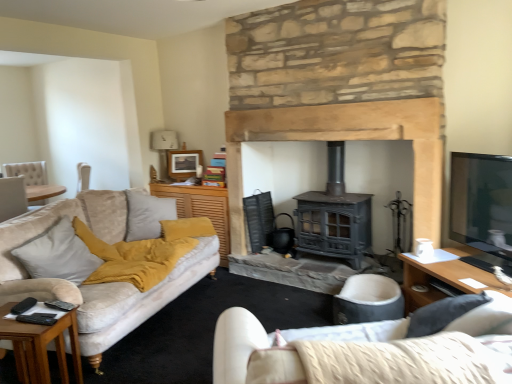
Describe the element at coordinates (201, 208) in the screenshot. The image size is (512, 384). I see `yellow fabric cushion at center, the 1th table when ordered from top to bottom` at that location.

At what (x,y) coordinates should I click in order to perform the action: click on wooden side table at lower left, placed as the first table when sorted from bottom to top. Please return your answer as a coordinate pair (x, y). The height and width of the screenshot is (384, 512). Looking at the image, I should click on (41, 347).

This screenshot has height=384, width=512. Find the location of `soft beige cushion at left`. soft beige cushion at left is located at coordinates (58, 254).

The image size is (512, 384). I want to click on wooden picture frame at upper center, so click(184, 163).

Describe the element at coordinates (369, 350) in the screenshot. I see `white fabric studio couch at lower right` at that location.

Image resolution: width=512 pixels, height=384 pixels. Describe the element at coordinates (340, 86) in the screenshot. I see `matte black stove at center` at that location.

This screenshot has height=384, width=512. I want to click on soft gray fabric armchair at center, so click(368, 300).

Is soft beige cushion at left touching white fabric studio couch at lower right?

soft beige cushion at left and white fabric studio couch at lower right are not in contact.

Is soft beige cushion at left to the left or to the right of white fabric studio couch at lower right in the image?

Based on their positions, soft beige cushion at left is located to the left of white fabric studio couch at lower right.

Where is `pillow below the white fabric studio couch at lower right (from a real-world perspective)`? This screenshot has width=512, height=384. pillow below the white fabric studio couch at lower right (from a real-world perspective) is located at coordinates (58, 254).

Is soft beige cushion at left oriented away from white fabric studio couch at lower right?

No, soft beige cushion at left's orientation is not away from white fabric studio couch at lower right.

From a real-world perspective, which object rests below the other?

soft gray fabric armchair at center, from a real-world perspective.

From the picture: Considering the relative sizes of soft gray fabric armchair at center and white fabric lampshade at upper center in the image provided, is soft gray fabric armchair at center shorter than white fabric lampshade at upper center?

Yes, soft gray fabric armchair at center is shorter than white fabric lampshade at upper center.

Is soft gray fabric armchair at center with white fabric lampshade at upper center?

No, soft gray fabric armchair at center is not making contact with white fabric lampshade at upper center.

From the image's perspective, would you say soft gray fabric armchair at center is shown under white fabric lampshade at upper center?

Correct, soft gray fabric armchair at center appears lower than white fabric lampshade at upper center in the image.

Could you tell me if wooden side table at lower left, the 2th table in the back-to-front sequence, is facing yellow fabric cushion at center, positioned as the second table in front-to-back order?

No, wooden side table at lower left, the 2th table in the back-to-front sequence, is not aimed at yellow fabric cushion at center, positioned as the second table in front-to-back order.

Which object is further away from the camera, wooden side table at lower left, the 1th table from the left, or yellow fabric cushion at center, the 1th table when ordered from top to bottom?

yellow fabric cushion at center, the 1th table when ordered from top to bottom, is further from the camera.

From the image's perspective, who appears lower, wooden side table at lower left, which is counted as the second table, starting from the top, or yellow fabric cushion at center, the first table when ordered from back to front?

wooden side table at lower left, which is counted as the second table, starting from the top, from the image's perspective.

Does wooden side table at lower left, the second table when ordered from right to left, have a smaller size compared to yellow fabric cushion at center, the 1th table when ordered from top to bottom?

No.

Is yellow fabric cushion at center, the 1th table when ordered from top to bottom, aimed at white fabric lampshade at upper center?

No, yellow fabric cushion at center, the 1th table when ordered from top to bottom, is not turned towards white fabric lampshade at upper center.

Between point (207, 206) and point (166, 133), which one is positioned behind?

The point (166, 133) is farther from the camera.

From the image's perspective, would you say yellow fabric cushion at center, the first table when ordered from back to front, is positioned over white fabric lampshade at upper center?

No, from the image's perspective, yellow fabric cushion at center, the first table when ordered from back to front, is not on top of white fabric lampshade at upper center.

In the scene shown: Could you measure the distance between wooden side table at lower left, the 1th table from the left, and white fabric studio couch at lower right?

The distance of wooden side table at lower left, the 1th table from the left, from white fabric studio couch at lower right is 1.55 meters.

Which of these two, wooden side table at lower left, the 2th table in the back-to-front sequence, or white fabric studio couch at lower right, is bigger?

With larger size is white fabric studio couch at lower right.

Which object is more forward, wooden side table at lower left, which ranks as the 1th table in front-to-back order, or white fabric studio couch at lower right?

white fabric studio couch at lower right is more forward.

Which object is wider, wooden side table at lower left, the 1th table from the left, or white fabric studio couch at lower right?

white fabric studio couch at lower right.

In the scene shown: Is the surface of white fabric studio couch at lower right in direct contact with matte black stove at center?

No, white fabric studio couch at lower right is not beside matte black stove at center.

Is white fabric studio couch at lower right spatially inside matte black stove at center, or outside of it?

white fabric studio couch at lower right is spatially situated outside matte black stove at center.

Which of these two, white fabric studio couch at lower right or matte black stove at center, is wider?

Wider between the two is white fabric studio couch at lower right.

Between white fabric studio couch at lower right and matte black stove at center, which one has more height?

matte black stove at center is taller.

Looking at this image, is white fabric studio couch at lower right positioned before yellow fabric cushion at center, acting as the 1th table starting from the right?

Yes, white fabric studio couch at lower right is in front of yellow fabric cushion at center, acting as the 1th table starting from the right.

You are a GUI agent. You are given a task and a screenshot of the screen. Output one action in this format:
    pyautogui.click(x=<x>, y=<y>)
    Task: Click on the studio couch that is below the yellow fabric cushion at center, the first table when ordered from back to front (from the image's perspective)
    The image size is (512, 384).
    Given the screenshot: What is the action you would take?
    click(x=369, y=350)

Is white fabric studio couch at lower right turned away from yellow fabric cushion at center, acting as the 1th table starting from the right?

white fabric studio couch at lower right is not turned away from yellow fabric cushion at center, acting as the 1th table starting from the right.

Considering the sizes of objects white fabric studio couch at lower right and yellow fabric cushion at center, acting as the 1th table starting from the right, in the image provided, who is bigger, white fabric studio couch at lower right or yellow fabric cushion at center, acting as the 1th table starting from the right,?

With larger size is white fabric studio couch at lower right.

This screenshot has width=512, height=384. Find the location of `pillow directly beneath the white fabric studio couch at lower right (from a real-world perspective)`. pillow directly beneath the white fabric studio couch at lower right (from a real-world perspective) is located at coordinates (58, 254).

At what (x,y) coordinates should I click in order to perform the action: click on lamp on the left of soft gray fabric armchair at center. Please return your answer as a coordinate pair (x, y). The image size is (512, 384). Looking at the image, I should click on (164, 148).

Based on their spatial positions, is yellow fabric cushion at center, which ranks as the 2th table in bottom-to-top order, or wooden picture frame at upper center further from soft gray fabric armchair at center?

wooden picture frame at upper center lies further to soft gray fabric armchair at center than the other object.

Which object lies nearer to the anchor point soft beige cushion at left, yellow fabric cushion at center, acting as the 1th table starting from the right, or wooden side table at lower left, placed as the first table when sorted from bottom to top?

wooden side table at lower left, placed as the first table when sorted from bottom to top, lies closer to soft beige cushion at left than the other object.

Which object lies further to the anchor point wooden picture frame at upper center, yellow fabric cushion at center, which ranks as the 2th table in bottom-to-top order, or soft gray fabric armchair at center?

Based on the image, soft gray fabric armchair at center appears to be further to wooden picture frame at upper center.

Based on their spatial positions, is soft beige cushion at left or matte black stove at center further from yellow fabric cushion at center, the 2th table positioned from the left?

soft beige cushion at left is positioned further to the anchor yellow fabric cushion at center, the 2th table positioned from the left.

Which object lies nearer to the anchor point wooden side table at lower left, the second table when ordered from right to left, white fabric lampshade at upper center or wooden picture frame at upper center?

Among the two, wooden picture frame at upper center is located nearer to wooden side table at lower left, the second table when ordered from right to left.

Considering their positions, is wooden picture frame at upper center positioned closer to white fabric studio couch at lower right than soft gray fabric armchair at center?

soft gray fabric armchair at center lies closer to white fabric studio couch at lower right than the other object.

Based on their spatial positions, is wooden picture frame at upper center or yellow fabric cushion at center, acting as the 1th table starting from the right, closer to wooden side table at lower left, the second table when ordered from right to left?

yellow fabric cushion at center, acting as the 1th table starting from the right, is closer to wooden side table at lower left, the second table when ordered from right to left.

Looking at the image, which one is located further to soft gray fabric armchair at center, soft beige cushion at left or yellow fabric cushion at center, positioned as the second table in front-to-back order?

soft beige cushion at left.

Identify the location of armchair located between wooden side table at lower left, the second table when ordered from right to left, and wooden picture frame at upper center in the depth direction. Image resolution: width=512 pixels, height=384 pixels. (368, 300).

Where is `armchair located between white fabric studio couch at lower right and yellow fabric cushion at center, acting as the 1th table starting from the right, in the depth direction`? armchair located between white fabric studio couch at lower right and yellow fabric cushion at center, acting as the 1th table starting from the right, in the depth direction is located at coordinates (368, 300).

Where is `fireplace between white fabric studio couch at lower right and white fabric lampshade at upper center in the front-back direction`? This screenshot has height=384, width=512. fireplace between white fabric studio couch at lower right and white fabric lampshade at upper center in the front-back direction is located at coordinates 340,86.

What are the coordinates of `fireplace positioned between soft gray fabric armchair at center and wooden picture frame at upper center from near to far` in the screenshot? It's located at (340, 86).